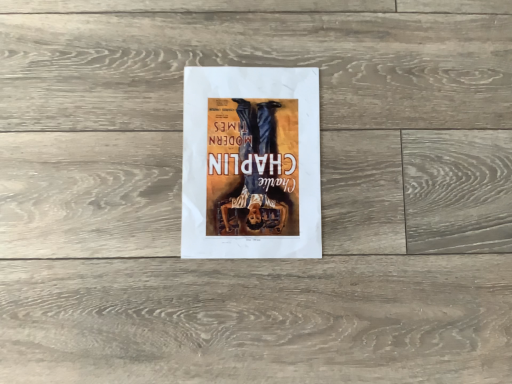
The width and height of the screenshot is (512, 384). I want to click on free point above matte paper poster at center (from a real-world perspective), so click(x=247, y=154).